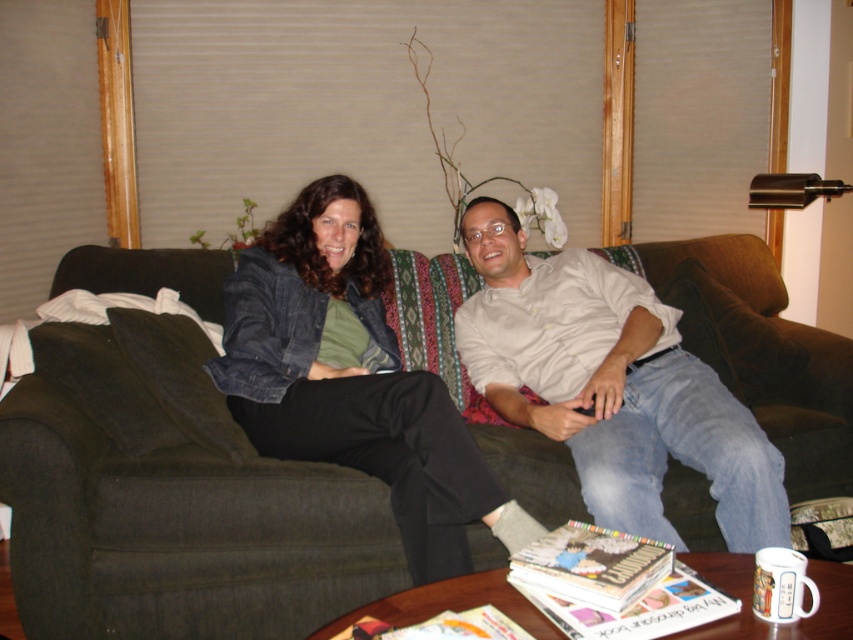
Question: Which object is positioned farthest from the light beige shirt at center?

Choices:
 (A) matte paper magazine at center
 (B) dark green fabric couch at center
 (C) denim jacket at center

Answer: (A)

Question: Where is light beige shirt at center located in relation to matte paper magazine at center in the image?

Choices:
 (A) left
 (B) right

Answer: (B)

Question: Which point is farther from the camera taking this photo?

Choices:
 (A) (155, 490)
 (B) (590, 604)

Answer: (A)

Question: Which of the following is the farthest from the observer?

Choices:
 (A) matte paper magazine at center
 (B) denim jacket at center
 (C) dark green fabric couch at center
 (D) light beige shirt at center

Answer: (D)

Question: Does denim jacket at center appear over light beige shirt at center?

Choices:
 (A) yes
 (B) no

Answer: (B)

Question: Can you confirm if light beige shirt at center is bigger than matte paper magazine at center?

Choices:
 (A) yes
 (B) no

Answer: (A)